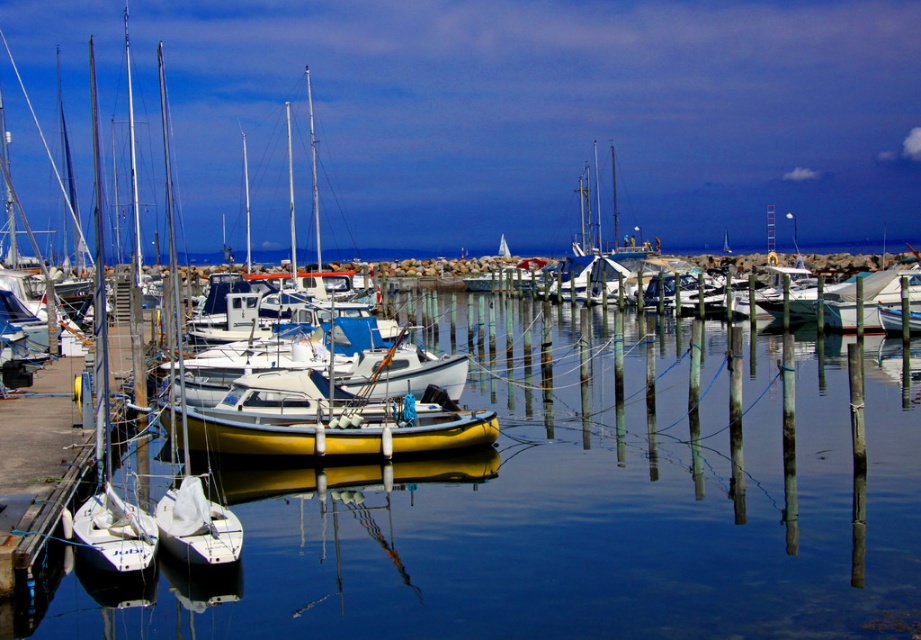
You are standing at the edge of the marina and see two points in the image, point 1 at coordinates point (x=228, y=481) and point 2 at coordinates point (x=889, y=280). Which point is closer to you?

Point (x=228, y=481) is closer to the viewer than point (x=889, y=280).

You are a boat inspector standing at the edge of the dock. You need to locate the yellow matte sailboat at center for inspection. According to the coordinates provided, where should you go to find it?

The yellow matte sailboat at center is located at coordinates point (248, 364), so you should go to that exact point to find it.